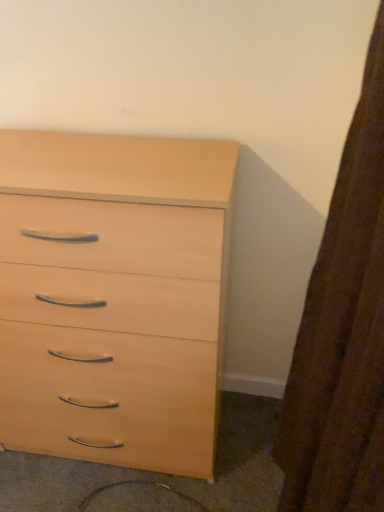
Question: Visually, is light wood chest of drawers at center positioned to the left or to the right of brown textured curtain at right?

Choices:
 (A) right
 (B) left

Answer: (B)

Question: Is point (175, 287) positioned closer to the camera than point (304, 390)?

Choices:
 (A) farther
 (B) closer

Answer: (A)

Question: Based on their relative distances, which object is farther from the light wood chest of drawers at center?

Choices:
 (A) light wood drawer at lower center
 (B) brown textured curtain at right

Answer: (B)

Question: Considering the real-world distances, which object is closest to the brown textured curtain at right?

Choices:
 (A) light wood chest of drawers at center
 (B) light wood drawer at lower center

Answer: (A)